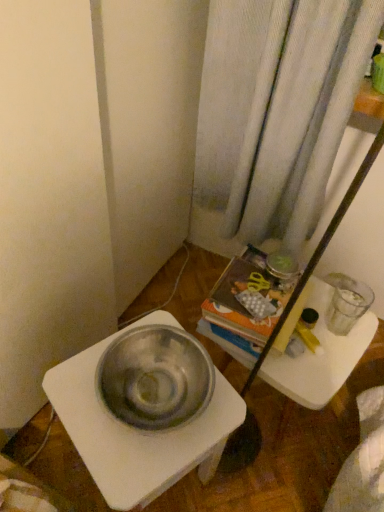
Question: From a real-world perspective, is metallic white table at lower left located beneath translucent plastic tray at center?

Choices:
 (A) yes
 (B) no

Answer: (B)

Question: Considering the relative positions of metallic white table at lower left and translucent plastic tray at center in the image provided, is metallic white table at lower left behind translucent plastic tray at center?

Choices:
 (A) yes
 (B) no

Answer: (B)

Question: From the image's perspective, is metallic white table at lower left located above translucent plastic tray at center?

Choices:
 (A) no
 (B) yes

Answer: (A)

Question: Does metallic white table at lower left come in front of translucent plastic tray at center?

Choices:
 (A) yes
 (B) no

Answer: (A)

Question: Is translucent plastic tray at center inside metallic white table at lower left?

Choices:
 (A) no
 (B) yes

Answer: (A)

Question: Considering the relative sizes of metallic white table at lower left and translucent plastic tray at center in the image provided, is metallic white table at lower left smaller than translucent plastic tray at center?

Choices:
 (A) no
 (B) yes

Answer: (A)

Question: Does translucent plastic tray at center have a greater width compared to metallic white table at lower left?

Choices:
 (A) no
 (B) yes

Answer: (A)

Question: From a real-world perspective, is translucent plastic tray at center physically above metallic white table at lower left?

Choices:
 (A) yes
 (B) no

Answer: (B)

Question: Is translucent plastic tray at center to the left of metallic white table at lower left from the viewer's perspective?

Choices:
 (A) no
 (B) yes

Answer: (A)

Question: Is translucent plastic tray at center shorter than metallic white table at lower left?

Choices:
 (A) yes
 (B) no

Answer: (A)

Question: Considering the relative sizes of translucent plastic tray at center and metallic white table at lower left in the image provided, is translucent plastic tray at center thinner than metallic white table at lower left?

Choices:
 (A) no
 (B) yes

Answer: (B)

Question: Is translucent plastic tray at center not within metallic white table at lower left?

Choices:
 (A) no
 (B) yes

Answer: (B)

Question: In terms of width, does translucent plastic tray at center look wider or thinner when compared to metallic white table at lower left?

Choices:
 (A) wide
 (B) thin

Answer: (B)